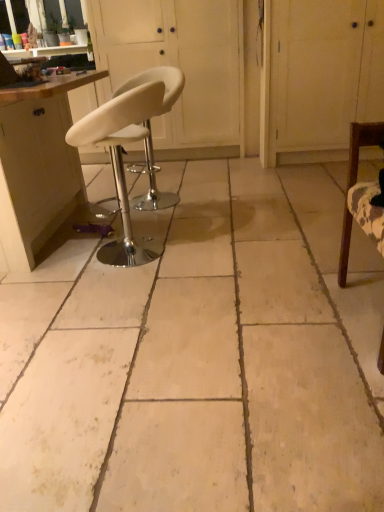
At what (x,y) coordinates should I click in order to perform the action: click on vacant area on the back side of white leather stool at center, the 3th chair positioned from the right. Please return your answer as a coordinate pair (x, y). Image resolution: width=384 pixels, height=512 pixels. Looking at the image, I should click on (158, 219).